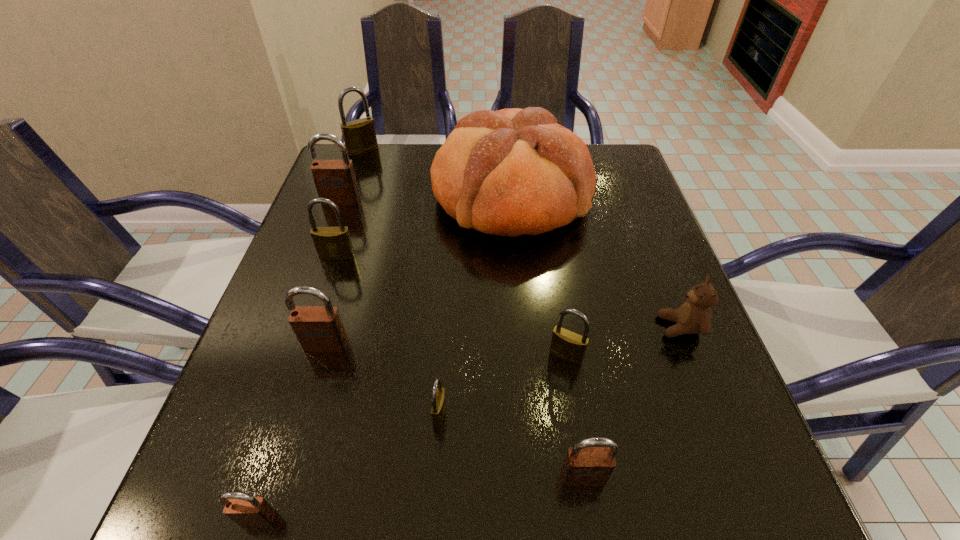
Identify the location of vacant region located 0.180m on the back of the sixth nearest padlock. (355, 201).

Find the location of a particular element. The width and height of the screenshot is (960, 540). vacant position located 0.130m on the front-facing side of the second biggest brown padlock is located at coordinates (302, 423).

The width and height of the screenshot is (960, 540). In order to click on vacant space situated 0.320m on the left of the second nearest brass padlock in this screenshot , I will do `click(366, 355)`.

At what (x,y) coordinates should I click in order to perform the action: click on vacant space situated 0.190m at the face of the teddy bear. Please return your answer as a coordinate pair (x, y). The height and width of the screenshot is (540, 960). Looking at the image, I should click on (556, 327).

At what (x,y) coordinates should I click in order to perform the action: click on free space located at the face of the teddy bear. Please return your answer as a coordinate pair (x, y). Looking at the image, I should click on (551, 327).

At what (x,y) coordinates should I click in order to perform the action: click on vacant position located at the face of the teddy bear. Please return your answer as a coordinate pair (x, y). Looking at the image, I should click on (502, 327).

You are a GUI agent. You are given a task and a screenshot of the screen. Output one action in this format:
    pyautogui.click(x=<x>, y=<y>)
    Task: Click on the blank area located 0.100m on the left of the smallest brass padlock
    
    Given the screenshot: What is the action you would take?
    pyautogui.click(x=370, y=414)

This screenshot has height=540, width=960. I want to click on bread at the far edge, so click(x=510, y=172).

Where is `padlock present at the far edge`? padlock present at the far edge is located at coordinates [359, 135].

At what (x,y) coordinates should I click in order to perform the action: click on bread present at the right edge. Please return your answer as a coordinate pair (x, y). Looking at the image, I should click on (510, 172).